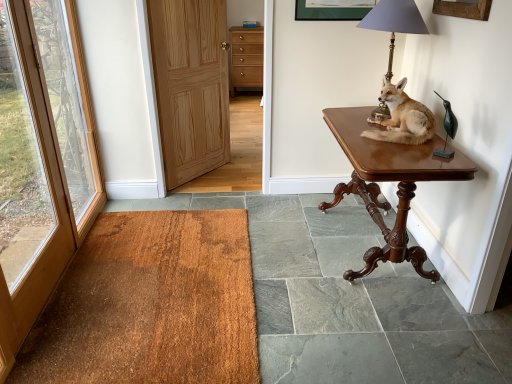
This screenshot has height=384, width=512. What do you see at coordinates (190, 85) in the screenshot? I see `light brown wood door at center, the first door positioned from the right` at bounding box center [190, 85].

At what (x,y) coordinates should I click in order to perform the action: click on brown fur taxidermy fox at upper right. Please return your answer as a coordinate pair (x, y). Looking at the image, I should click on (402, 117).

What do you see at coordinates (246, 57) in the screenshot? I see `matte wood drawers at center` at bounding box center [246, 57].

At what (x,y) coordinates should I click in order to perform the action: click on matte brass lamp at upper right. Please return your answer as a coordinate pair (x, y). The image size is (512, 384). Looking at the image, I should click on (394, 22).

Identify the location of brown wood door at left, which ranks as the first door in left-to-right order. This screenshot has width=512, height=384. (41, 159).

Choose the correct answer: Is matte wood drawers at center inside blue plastic corded phone at upper center or outside it?

matte wood drawers at center is not enclosed by blue plastic corded phone at upper center.

Find the location of a particular element. The height and width of the screenshot is (384, 512). cabinetry that is on the left side of blue plastic corded phone at upper center is located at coordinates (246, 57).

From the image's perspective, which is above, matte wood drawers at center or blue plastic corded phone at upper center?

From the image's view, blue plastic corded phone at upper center is above.

Based on the photo, does matte wood drawers at center have a greater width compared to blue plastic corded phone at upper center?

Yes, matte wood drawers at center is wider than blue plastic corded phone at upper center.

Which object is thinner, brown wood door at left, the 2th door viewed from the right, or brown fur taxidermy fox at upper right?

Answer: With smaller width is brown wood door at left, the 2th door viewed from the right.

Is brown wood door at left, the 2th door viewed from the right, not near brown fur taxidermy fox at upper right?

Indeed, brown wood door at left, the 2th door viewed from the right, is not near brown fur taxidermy fox at upper right.

Between brown wood door at left, which ranks as the first door in left-to-right order, and brown fur taxidermy fox at upper right, which one appears on the left side from the viewer's perspective?

From the viewer's perspective, brown wood door at left, which ranks as the first door in left-to-right order, appears more on the left side.

What are the coordinates of `cabinetry lying on the left of blue plastic corded phone at upper center` in the screenshot? It's located at (246, 57).

Is matte wood drawers at center at the back of blue plastic corded phone at upper center?

Yes, blue plastic corded phone at upper center is facing away from matte wood drawers at center.

From a real-world perspective, is blue plastic corded phone at upper center physically below matte wood drawers at center?

No, from a real-world perspective, blue plastic corded phone at upper center is not below matte wood drawers at center.

Is blue plastic corded phone at upper center surrounding matte wood drawers at center?

No, matte wood drawers at center is not inside blue plastic corded phone at upper center.

Who is taller, brown wood door at left, the 2th door viewed from the right, or brown wood table at right?

Standing taller between the two is brown wood door at left, the 2th door viewed from the right.

Is the position of brown wood door at left, which ranks as the first door in left-to-right order, less distant than that of brown wood table at right?

Yes, it is.

From the picture: Which point is more distant from viewer, (46, 209) or (383, 173)?

The point (46, 209) is more distant.

Is brown wood door at left, the 2th door viewed from the right, not within brown wood table at right?

Yes, brown wood door at left, the 2th door viewed from the right, is located beyond the bounds of brown wood table at right.

Considering the positions of objects matte wood drawers at center and brown fur taxidermy fox at upper right in the image provided, who is in front, matte wood drawers at center or brown fur taxidermy fox at upper right?

brown fur taxidermy fox at upper right is more forward.

Which of these two, matte wood drawers at center or brown fur taxidermy fox at upper right, is bigger?

matte wood drawers at center is bigger.

From the image's perspective, is brown wood door at left, which ranks as the first door in left-to-right order, above or below matte wood drawers at center?

Clearly, from the image's perspective, brown wood door at left, which ranks as the first door in left-to-right order, is below matte wood drawers at center.

Locate an element on the screen. cabinetry below the brown wood door at left, the 2th door viewed from the right (from a real-world perspective) is located at coordinates (246, 57).

Between point (5, 262) and point (232, 42), which one is positioned behind?

Point (232, 42)

Considering the positions of points (40, 48) and (158, 59), is point (40, 48) closer to camera compared to point (158, 59)?

Yes, point (40, 48) is closer to viewer.

Is the depth of brown wood door at left, which ranks as the first door in left-to-right order, less than that of light brown wood door at center, the first door positioned from the right?

Yes, brown wood door at left, which ranks as the first door in left-to-right order, is closer to the viewer.

I want to click on cabinetry to the left of blue plastic corded phone at upper center, so click(x=246, y=57).

I want to click on dog above the brown wood door at left, which ranks as the first door in left-to-right order (from a real-world perspective), so click(402, 117).

When comparing their distances from light brown wood door at center, which appears as the 2th door when viewed from the left, does matte brass lamp at upper right or blue plastic corded phone at upper center seem further?

blue plastic corded phone at upper center is further to light brown wood door at center, which appears as the 2th door when viewed from the left.

From the picture: When comparing their distances from matte brass lamp at upper right, does brown fur taxidermy fox at upper right or blue plastic corded phone at upper center seem further?

Based on the image, blue plastic corded phone at upper center appears to be further to matte brass lamp at upper right.

Considering their positions, is brown wood door at left, which ranks as the first door in left-to-right order, positioned further to brown wood table at right than brown textured mat at lower left?

brown wood door at left, which ranks as the first door in left-to-right order, is further to brown wood table at right.

Looking at the image, which one is located closer to brown fur taxidermy fox at upper right, matte wood drawers at center or brown textured mat at lower left?

brown textured mat at lower left is closer to brown fur taxidermy fox at upper right.

From the image, which object appears to be farther from matte brass lamp at upper right, light brown wood door at center, the first door positioned from the right, or brown wood door at left, which ranks as the first door in left-to-right order?

Among the two, brown wood door at left, which ranks as the first door in left-to-right order, is located further to matte brass lamp at upper right.

Based on their spatial positions, is matte brass lamp at upper right or brown wood door at left, the 2th door viewed from the right, closer to brown textured mat at lower left?

The object closer to brown textured mat at lower left is brown wood door at left, the 2th door viewed from the right.

Based on their spatial positions, is light brown wood door at center, the first door positioned from the right, or blue plastic corded phone at upper center closer to brown wood table at right?

Among the two, light brown wood door at center, the first door positioned from the right, is located nearer to brown wood table at right.

Considering their positions, is brown wood door at left, which ranks as the first door in left-to-right order, positioned closer to brown fur taxidermy fox at upper right than brown wood table at right?

The object closer to brown fur taxidermy fox at upper right is brown wood table at right.

The image size is (512, 384). In order to click on dog between brown wood table at right and matte wood drawers at center from front to back in this screenshot , I will do `click(402, 117)`.

I want to click on door between brown wood door at left, which ranks as the first door in left-to-right order, and brown fur taxidermy fox at upper right from left to right, so click(190, 85).

Where is `dog between brown wood door at left, the 2th door viewed from the right, and blue plastic corded phone at upper center in the front-back direction`? dog between brown wood door at left, the 2th door viewed from the right, and blue plastic corded phone at upper center in the front-back direction is located at coordinates (402, 117).

This screenshot has height=384, width=512. I want to click on mat between brown wood door at left, which ranks as the first door in left-to-right order, and matte brass lamp at upper right from left to right, so click(150, 304).